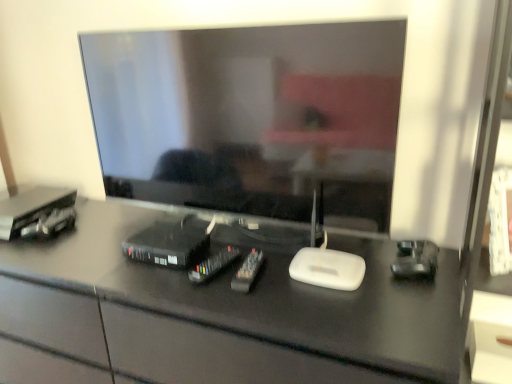
What is the approximate height of black plastic dvd player at lower left, positioned as the 2th equipment in left-to-right order?

The height of black plastic dvd player at lower left, positioned as the 2th equipment in left-to-right order, is 2.48 inches.

Describe the element at coordinates (250, 118) in the screenshot. I see `matte black television at center` at that location.

I want to click on metallic black cable box at left, marked as the first equipment in a left-to-right arrangement, so click(x=37, y=212).

Find the location of a particular element. The height and width of the screenshot is (384, 512). desk in front of the black plastic dvd player at lower left, which is the third equipment in right-to-left order is located at coordinates (224, 314).

Considering the relative positions of black glossy desk at center and black plastic dvd player at lower left, positioned as the 2th equipment in left-to-right order, in the image provided, is black glossy desk at center behind black plastic dvd player at lower left, positioned as the 2th equipment in left-to-right order,?

No, black glossy desk at center is closer to the camera.

Consider the image. Visually, is black glossy desk at center positioned to the left or to the right of black plastic dvd player at lower left, positioned as the 2th equipment in left-to-right order?

black glossy desk at center is positioned on black plastic dvd player at lower left, positioned as the 2th equipment in left-to-right order,'s left side.

Would you say black plastic dvd player at lower left, which is the third equipment in right-to-left order, is inside or outside matte black television at center?

black plastic dvd player at lower left, which is the third equipment in right-to-left order, is spatially situated outside matte black television at center.

Is black plastic dvd player at lower left, positioned as the 2th equipment in left-to-right order, in front of or behind matte black television at center in the image?

Clearly, black plastic dvd player at lower left, positioned as the 2th equipment in left-to-right order, is behind matte black television at center.

From the image's perspective, which equipment is the 2nd one below the matte black television at center? Please provide its 2D coordinates.

[(169, 242)]

In terms of width, does black plastic dvd player at lower left, which is the third equipment in right-to-left order, look wider or thinner when compared to matte black television at center?

In the image, black plastic dvd player at lower left, which is the third equipment in right-to-left order, appears to be wider than matte black television at center.

Is the depth of matte black television at center less than that of black plastic remote control at center, the 3th equipment in the left-to-right sequence?

That is True.

Is matte black television at center looking in the opposite direction of black plastic remote control at center, the 3th equipment in the left-to-right sequence?

No, matte black television at center's orientation is not away from black plastic remote control at center, the 3th equipment in the left-to-right sequence.

Is matte black television at center spatially inside black plastic remote control at center, the 3th equipment in the left-to-right sequence, or outside of it?

matte black television at center is outside black plastic remote control at center, the 3th equipment in the left-to-right sequence.

Looking at the image, does matte black television at center seem bigger or smaller compared to black plastic remote control at center, the second equipment viewed from the right?

Clearly, matte black television at center is larger in size than black plastic remote control at center, the second equipment viewed from the right.

Can you confirm if black glossy desk at center is positioned to the right of matte black television at center?

In fact, black glossy desk at center is to the left of matte black television at center.

Is point (120, 281) closer or farther from the camera than point (170, 80)?

Point (120, 281) appears to be closer to the viewer than point (170, 80).

Is black glossy desk at center positioned with its back to matte black television at center?

No.

Which object is thinner, black glossy desk at center or matte black television at center?

With smaller width is matte black television at center.

How many degrees apart are the facing directions of matte black television at center and black glossy desk at center?

They differ by 1.45 degrees in their facing directions.

Is matte black television at center at the right side of black glossy desk at center?

Yes.

Does matte black television at center have a lesser height compared to black glossy desk at center?

Yes.

From a real-world perspective, is matte black television at center physically located above or below black glossy desk at center?

matte black television at center is situated higher than black glossy desk at center in the real world.

Are black plastic dvd player at lower left, which is the third equipment in right-to-left order, and black glossy desk at center beside each other?

No, black plastic dvd player at lower left, which is the third equipment in right-to-left order, is not beside black glossy desk at center.

The height and width of the screenshot is (384, 512). Identify the location of the 3rd equipment positioned above the black glossy desk at center (from a real-world perspective). (169, 242).

From a real-world perspective, who is located lower, black plastic dvd player at lower left, which is the third equipment in right-to-left order, or black glossy desk at center?

black glossy desk at center.

Which of these two, black plastic dvd player at lower left, positioned as the 2th equipment in left-to-right order, or black glossy desk at center, stands shorter?

black plastic dvd player at lower left, positioned as the 2th equipment in left-to-right order, is shorter.

Considering the sizes of black glossy desk at center and matte white drawer at lower right in the image, is black glossy desk at center wider or thinner than matte white drawer at lower right?

Clearly, black glossy desk at center has more width compared to matte white drawer at lower right.

Which is more to the left, black glossy desk at center or matte white drawer at lower right?

Positioned to the left is black glossy desk at center.

From a real-world perspective, which is physically below, black glossy desk at center or matte white drawer at lower right?

black glossy desk at center is physically lower.

Considering the relative sizes of black glossy desk at center and matte white drawer at lower right in the image provided, is black glossy desk at center bigger than matte white drawer at lower right?

Correct, black glossy desk at center is larger in size than matte white drawer at lower right.

Identify the location of desk in front of the black plastic dvd player at lower left, which is the third equipment in right-to-left order. (224, 314).

Where is `the 3rd equipment behind the matte black television at center, counting from the anchor's position`? the 3rd equipment behind the matte black television at center, counting from the anchor's position is located at coordinates (169, 242).

Based on their spatial positions, is matte black television at center or black glossy desk at center closer to black plastic dvd player at lower left, which is the third equipment in right-to-left order?

black glossy desk at center lies closer to black plastic dvd player at lower left, which is the third equipment in right-to-left order, than the other object.

Looking at the image, which one is located further to black plastic remote control at center, the second equipment viewed from the right, black plastic dvd player at lower left, which is the third equipment in right-to-left order, or matte white drawer at lower right?

matte white drawer at lower right is further to black plastic remote control at center, the second equipment viewed from the right.

Estimate the real-world distances between objects in this image. Which object is closer to matte black television at center, black plastic remote controls at center, the 1th equipment when ordered from right to left, or black glossy desk at center?

Among the two, black glossy desk at center is located nearer to matte black television at center.

Estimate the real-world distances between objects in this image. Which object is closer to metallic black cable box at left, placed as the 4th equipment when sorted from right to left, black plastic remote controls at center, the 1th equipment when ordered from right to left, or matte black television at center?

matte black television at center lies closer to metallic black cable box at left, placed as the 4th equipment when sorted from right to left, than the other object.

Which object lies further to the anchor point matte black television at center, black plastic remote control at center, the 3th equipment in the left-to-right sequence, or black plastic remote controls at center, the 4th equipment when ordered from left to right?

The object further to matte black television at center is black plastic remote controls at center, the 4th equipment when ordered from left to right.

Estimate the real-world distances between objects in this image. Which object is closer to black plastic remote control at center, the second equipment viewed from the right, metallic black cable box at left, marked as the first equipment in a left-to-right arrangement, or matte white drawer at lower right?

Among the two, metallic black cable box at left, marked as the first equipment in a left-to-right arrangement, is located nearer to black plastic remote control at center, the second equipment viewed from the right.

Which object lies nearer to the anchor point metallic black cable box at left, marked as the first equipment in a left-to-right arrangement, black plastic remote control at center, the 3th equipment in the left-to-right sequence, or matte white drawer at lower right?

Among the two, black plastic remote control at center, the 3th equipment in the left-to-right sequence, is located nearer to metallic black cable box at left, marked as the first equipment in a left-to-right arrangement.

Estimate the real-world distances between objects in this image. Which object is further from black plastic remote controls at center, the 1th equipment when ordered from right to left, black plastic remote control at center, the 3th equipment in the left-to-right sequence, or black plastic dvd player at lower left, which is the third equipment in right-to-left order?

black plastic dvd player at lower left, which is the third equipment in right-to-left order, is further to black plastic remote controls at center, the 1th equipment when ordered from right to left.

Find the location of a particular element. Image resolution: width=512 pixels, height=384 pixels. equipment situated between metallic black cable box at left, marked as the first equipment in a left-to-right arrangement, and black plastic remote control at center, the second equipment viewed from the right, from left to right is located at coordinates (169, 242).

I want to click on equipment between black plastic remote control at center, the second equipment viewed from the right, and matte white drawer at lower right, in the horizontal direction, so click(248, 271).

Locate an element on the screen. The image size is (512, 384). television between black glossy desk at center and matte white drawer at lower right from left to right is located at coordinates (250, 118).

Locate an element on the screen. The image size is (512, 384). desk between metallic black cable box at left, marked as the first equipment in a left-to-right arrangement, and black plastic dvd player at lower left, positioned as the 2th equipment in left-to-right order, from left to right is located at coordinates (224, 314).